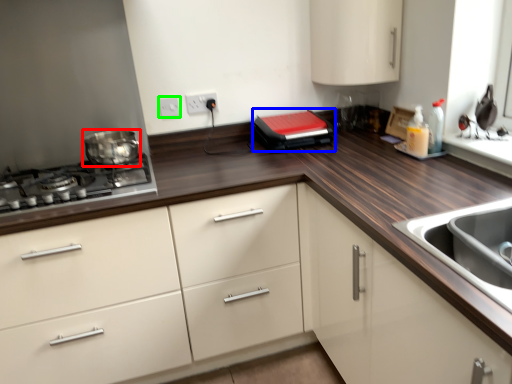
Question: Which object is the farthest from home appliance (highlighted by a red box)? Choose among these: kitchen appliance (highlighted by a blue box) or electric outlet (highlighted by a green box).

Choices:
 (A) kitchen appliance
 (B) electric outlet

Answer: (A)